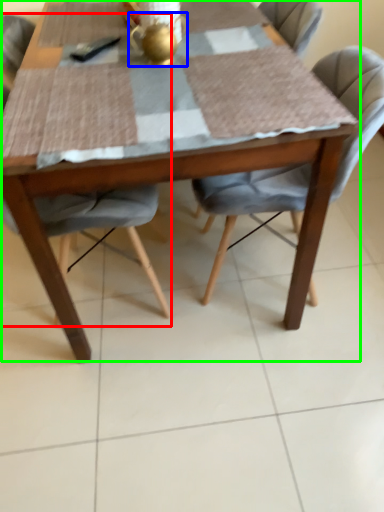
Question: Which object is positioned closest to chair (highlighted by a red box)? Select from tea pot (highlighted by a blue box) and kitchen & dining room table (highlighted by a green box).

Choices:
 (A) tea pot
 (B) kitchen & dining room table

Answer: (B)